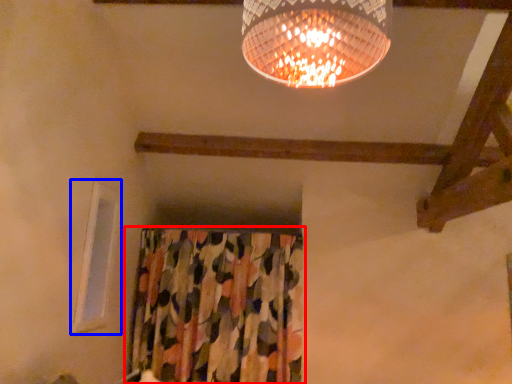
Question: Which object is further to the camera taking this photo, curtain (highlighted by a red box) or window (highlighted by a blue box)?

Choices:
 (A) curtain
 (B) window

Answer: (A)